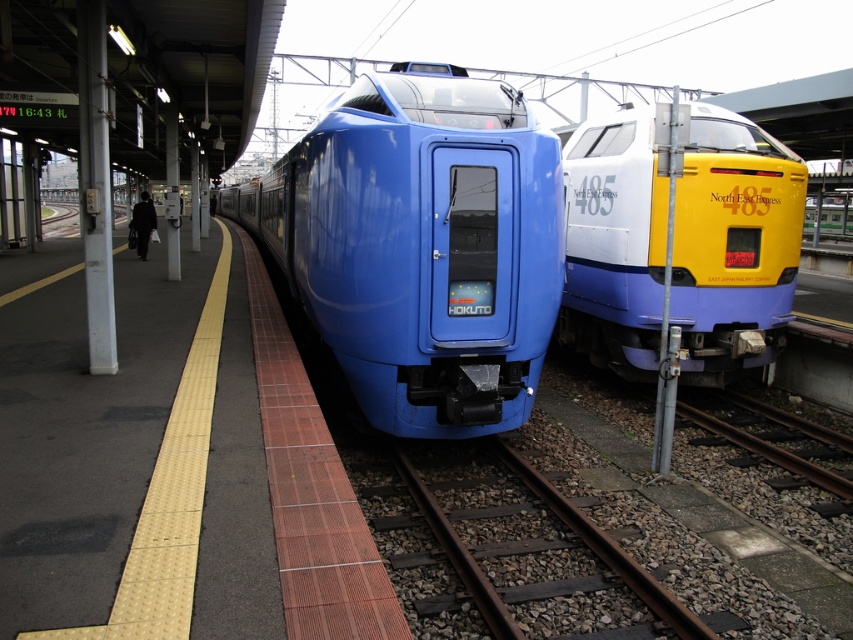
Question: Among these objects, which one is nearest to the camera?

Choices:
 (A) yellow/white glossy train at right
 (B) black fabric bag at left
 (C) rusty metal train track at center
 (D) smooth metal track at lower right

Answer: (C)

Question: Can you confirm if matte blue train at center is smaller than rusty metal train track at center?

Choices:
 (A) yes
 (B) no

Answer: (B)

Question: Where is black fabric bag at left located in relation to matte black bag at left in the image?

Choices:
 (A) right
 (B) left

Answer: (A)

Question: Which is nearer to the smooth metal track at lower right?

Choices:
 (A) matte blue train at center
 (B) black fabric bag at left

Answer: (A)

Question: Which point appears closest to the camera in this image?

Choices:
 (A) (343, 113)
 (B) (610, 552)

Answer: (B)

Question: Does yellow/white glossy train at right lie behind smooth metal track at lower right?

Choices:
 (A) no
 (B) yes

Answer: (B)